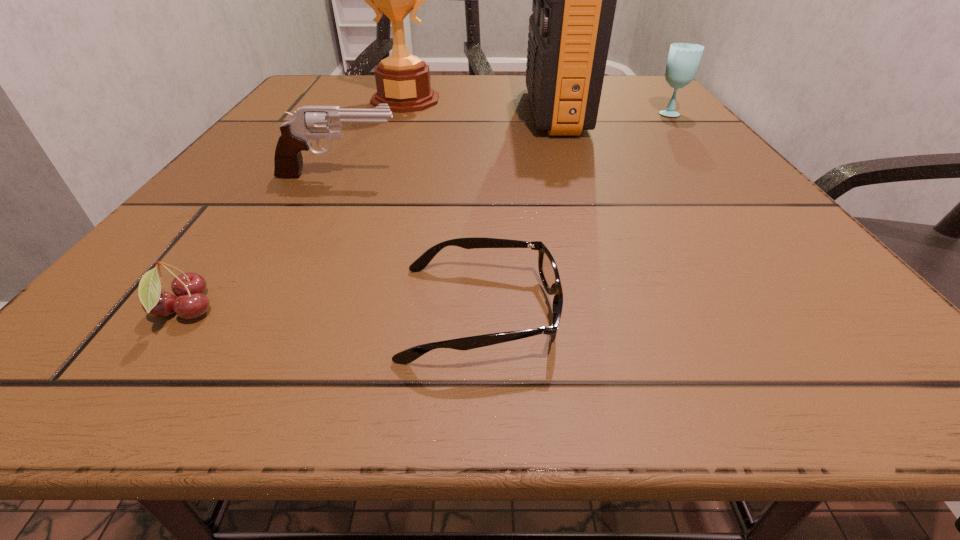
Locate an element on the screen. The width and height of the screenshot is (960, 540). radio receiver is located at coordinates (574, 0).

You are a GUI agent. You are given a task and a screenshot of the screen. Output one action in this format:
    pyautogui.click(x=<x>, y=<y>)
    Task: Click on the award
    
    Given the screenshot: What is the action you would take?
    pyautogui.click(x=403, y=81)

The width and height of the screenshot is (960, 540). Identify the location of the rightmost object. (683, 60).

The width and height of the screenshot is (960, 540). Identify the location of the fourth farthest object. (308, 122).

Where is `cherry`? Image resolution: width=960 pixels, height=540 pixels. cherry is located at coordinates (190, 303).

At what (x,y) coordinates should I click in order to perform the action: click on spectacles. Please return your answer as a coordinate pair (x, y). This screenshot has width=960, height=540. Looking at the image, I should click on (548, 271).

Locate an element on the screen. The height and width of the screenshot is (540, 960). vacant space located on the front-facing side of the radio receiver is located at coordinates (339, 111).

You are a GUI agent. You are given a task and a screenshot of the screen. Output one action in this format:
    pyautogui.click(x=<x>, y=<y>)
    Task: Click on the blank area located on the front-facing side of the radio receiver
    This screenshot has height=540, width=960.
    Given the screenshot: What is the action you would take?
    pyautogui.click(x=494, y=111)

The height and width of the screenshot is (540, 960). Identify the location of free space located 0.260m on the front-facing side of the radio receiver. [x=404, y=111].

Identify the location of free location located 0.050m on the front-facing side of the award. The width and height of the screenshot is (960, 540). (397, 123).